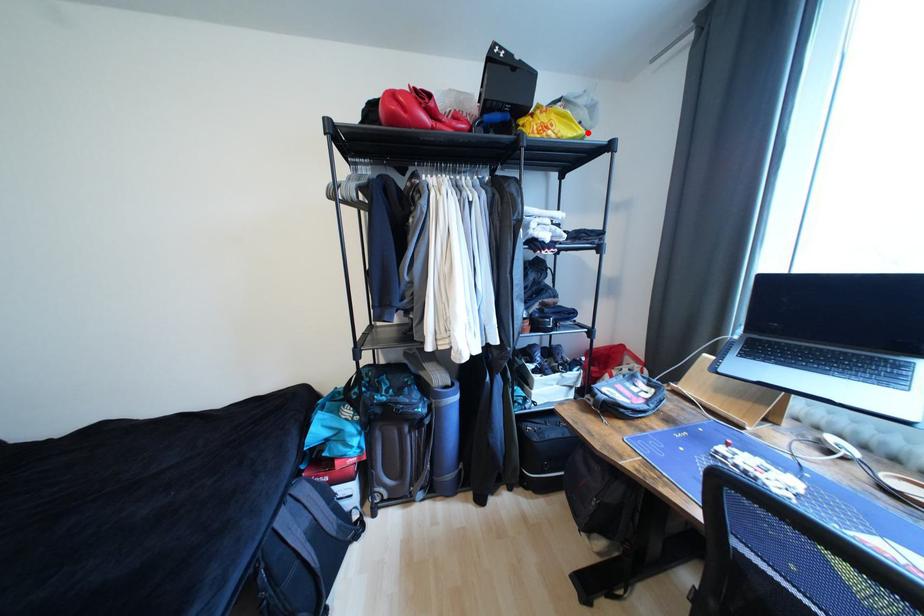
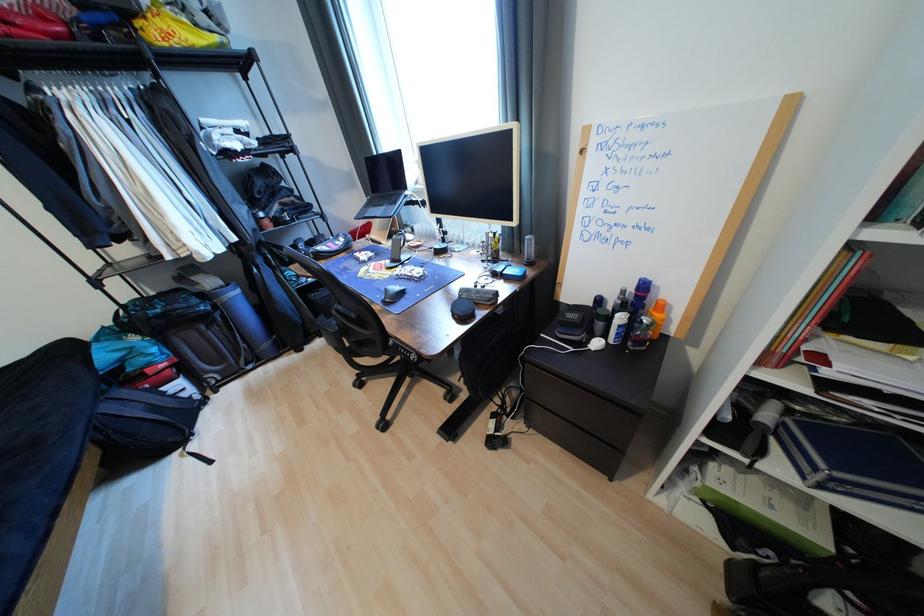
In the second image, find the point that corresponds to the highlighted location in the first image.

(223, 39)